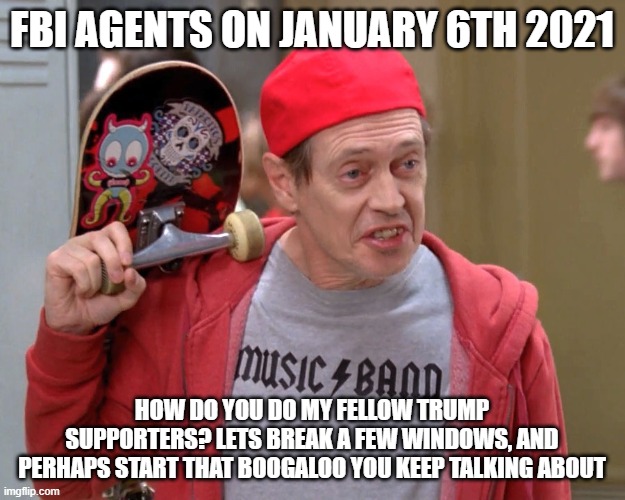
Identify the location of hood. (508, 310).